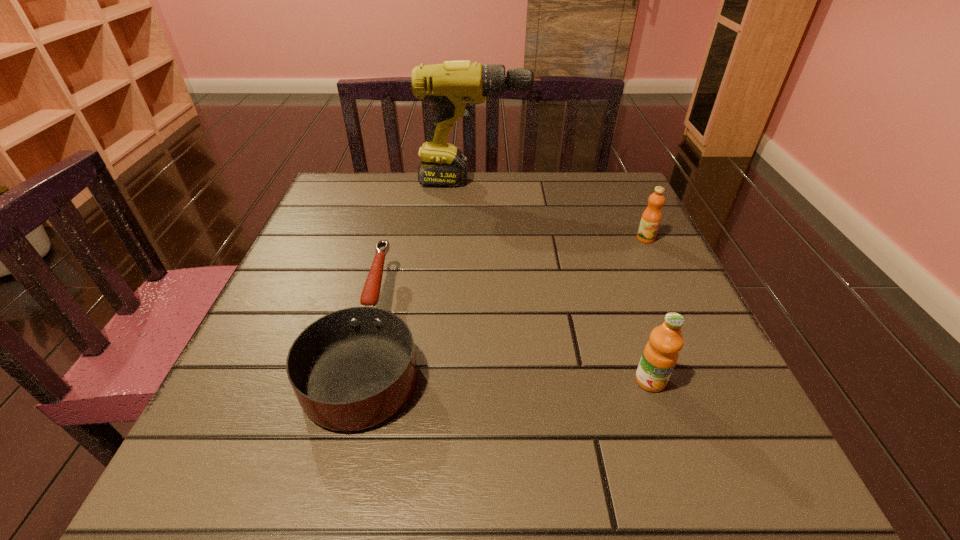
At what (x,y) coordinates should I click in order to perform the action: click on the tallest object. Please return your answer as a coordinate pair (x, y). The height and width of the screenshot is (540, 960). Looking at the image, I should click on (454, 86).

You are a GUI agent. You are given a task and a screenshot of the screen. Output one action in this format:
    pyautogui.click(x=<x>, y=<y>)
    Task: Click on the farthest object
    Image resolution: width=960 pixels, height=540 pixels.
    Given the screenshot: What is the action you would take?
    pyautogui.click(x=454, y=86)

Locate an element on the screen. This screenshot has width=960, height=540. the third object from left to right is located at coordinates (660, 355).

The width and height of the screenshot is (960, 540). I want to click on the nearer orange juice, so click(x=660, y=355).

At what (x,y) coordinates should I click in order to perform the action: click on the farther orange juice. Please return your answer as a coordinate pair (x, y). This screenshot has height=540, width=960. Looking at the image, I should click on (651, 217).

This screenshot has width=960, height=540. What are the coordinates of `the right orange juice` in the screenshot? It's located at (651, 217).

The width and height of the screenshot is (960, 540). I want to click on pan, so click(x=352, y=369).

Image resolution: width=960 pixels, height=540 pixels. I want to click on vacant space located on the handle side of the farthest object, so click(x=581, y=182).

Identify the location of vacant space located on the label of the second object from right to left. Image resolution: width=960 pixels, height=540 pixels. (689, 494).

Identify the location of vacant space located on the front label of the second farthest object. (704, 360).